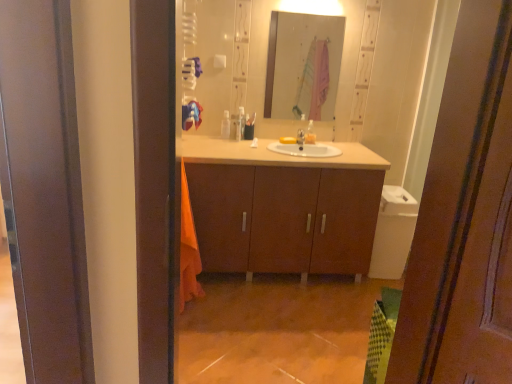
In order to face translucent plastic toothbrush holder at center, the second toiletry from the right, should I rotate leftwards or rightwards?

You should look left and rotate roughly 1.820 degrees.

How much space does orange cotton beach towel at left, acting as the second beach towel starting from the top, occupy horizontally?

6.02 inches.

What do you see at coordinates (310, 133) in the screenshot?
I see `translucent plastic bag at center, arranged as the 3th toiletry when viewed from the left` at bounding box center [310, 133].

This screenshot has width=512, height=384. What are the coordinates of `white plastic container at center, which is counted as the 1th toiletry, starting from the left` in the screenshot? It's located at (225, 125).

Can you see white plastic container at center, which is counted as the 1th toiletry, starting from the left, touching blue fabric beach towel at center, the 2th beach towel positioned from the bottom?

white plastic container at center, which is counted as the 1th toiletry, starting from the left, and blue fabric beach towel at center, the 2th beach towel positioned from the bottom, are not in contact.

From the image's perspective, is white plastic container at center, the 3th toiletry positioned from the right, positioned above or below blue fabric beach towel at center, arranged as the first beach towel when viewed from the top?

white plastic container at center, the 3th toiletry positioned from the right, is above blue fabric beach towel at center, arranged as the first beach towel when viewed from the top.

Is point (228, 119) farther from viewer compared to point (195, 121)?

Yes, point (228, 119) is behind point (195, 121).

Which is in front, point (224, 111) or point (300, 133)?

Point (300, 133)

Which is more to the left, white plastic container at center, which is counted as the 1th toiletry, starting from the left, or silver metallic tap at center?

white plastic container at center, which is counted as the 1th toiletry, starting from the left.

How many degrees apart are the facing directions of white plastic container at center, which is counted as the 1th toiletry, starting from the left, and silver metallic tap at center?

The angle between the facing direction of white plastic container at center, which is counted as the 1th toiletry, starting from the left, and the facing direction of silver metallic tap at center is 0.000344 degrees.

From a real-world perspective, is white plastic container at center, the 3th toiletry positioned from the right, located beneath silver metallic tap at center?

No, from a real-world perspective, white plastic container at center, the 3th toiletry positioned from the right, is not beneath silver metallic tap at center.

Where is `tap behind the clear glass mirror at upper center`? tap behind the clear glass mirror at upper center is located at coordinates (300, 137).

Is clear glass mirror at upper center positioned with its back to silver metallic tap at center?

clear glass mirror at upper center does not have its back to silver metallic tap at center.

Is clear glass mirror at upper center to the left of silver metallic tap at center from the viewer's perspective?

No, clear glass mirror at upper center is not to the left of silver metallic tap at center.

Is clear glass mirror at upper center not close to silver metallic tap at center?

That's right, there is a large distance between clear glass mirror at upper center and silver metallic tap at center.

Based on the photo, who is taller, orange cotton beach towel at left, acting as the 1th beach towel starting from the bottom, or clear glass mirror at upper center?

Standing taller between the two is orange cotton beach towel at left, acting as the 1th beach towel starting from the bottom.

Is orange cotton beach towel at left, acting as the second beach towel starting from the top, turned away from clear glass mirror at upper center?

orange cotton beach towel at left, acting as the second beach towel starting from the top, does not have its back to clear glass mirror at upper center.

Is orange cotton beach towel at left, acting as the second beach towel starting from the top, not inside clear glass mirror at upper center?

Indeed, orange cotton beach towel at left, acting as the second beach towel starting from the top, is completely outside clear glass mirror at upper center.

There is a clear glass mirror at upper center. Where is `the 2nd beach towel below it (from the image's perspective)`? The width and height of the screenshot is (512, 384). the 2nd beach towel below it (from the image's perspective) is located at coordinates (188, 249).

Could you tell me if orange cotton beach towel at left, acting as the second beach towel starting from the top, is facing silver metallic tap at center?

No.

Is silver metallic tap at center surrounded by orange cotton beach towel at left, acting as the 1th beach towel starting from the bottom?

Actually, silver metallic tap at center is outside orange cotton beach towel at left, acting as the 1th beach towel starting from the bottom.

From a real-world perspective, who is located higher, orange cotton beach towel at left, acting as the second beach towel starting from the top, or silver metallic tap at center?

silver metallic tap at center is physically above.

From a real-world perspective, is white plastic container at center, which is counted as the 1th toiletry, starting from the left, positioned above or below translucent plastic bag at center, arranged as the 3th toiletry when viewed from the left?

In terms of real-world spatial position, white plastic container at center, which is counted as the 1th toiletry, starting from the left, is below translucent plastic bag at center, arranged as the 3th toiletry when viewed from the left.

Is point (229, 126) farther from viewer compared to point (315, 139)?

That is True.

How distant is white plastic container at center, the 3th toiletry positioned from the right, from translucent plastic bag at center, the first toiletry from the right?

The distance of white plastic container at center, the 3th toiletry positioned from the right, from translucent plastic bag at center, the first toiletry from the right, is 22.09 inches.

Which object is closer to the camera taking this photo, white plastic container at center, which is counted as the 1th toiletry, starting from the left, or translucent plastic bag at center, arranged as the 3th toiletry when viewed from the left?

translucent plastic bag at center, arranged as the 3th toiletry when viewed from the left, is closer to the camera.

Between blue fabric beach towel at center, the 2th beach towel positioned from the bottom, and matte wood cabinet at center, which one has larger width?

Wider between the two is matte wood cabinet at center.

Is blue fabric beach towel at center, arranged as the first beach towel when viewed from the top, bigger than matte wood cabinet at center?

Actually, blue fabric beach towel at center, arranged as the first beach towel when viewed from the top, might be smaller than matte wood cabinet at center.

From a real-world perspective, is blue fabric beach towel at center, the 2th beach towel positioned from the bottom, located beneath matte wood cabinet at center?

Incorrect, from a real-world perspective, blue fabric beach towel at center, the 2th beach towel positioned from the bottom, is higher than matte wood cabinet at center.

Is the surface of blue fabric beach towel at center, arranged as the first beach towel when viewed from the top, in direct contact with matte wood cabinet at center?

blue fabric beach towel at center, arranged as the first beach towel when viewed from the top, and matte wood cabinet at center are not in contact.

Locate an element on the screen. This screenshot has height=384, width=512. beach towel above the white plastic container at center, which is counted as the 1th toiletry, starting from the left (from a real-world perspective) is located at coordinates (191, 115).

I want to click on tap that is on the right side of white plastic container at center, the 3th toiletry positioned from the right, so click(300, 137).

Looking at the image, which one is located closer to blue fabric beach towel at center, the 2th beach towel positioned from the bottom, orange cotton beach towel at left, acting as the 1th beach towel starting from the bottom, or translucent plastic toothbrush holder at center, positioned as the second toiletry in left-to-right order?

Among the two, translucent plastic toothbrush holder at center, positioned as the second toiletry in left-to-right order, is located nearer to blue fabric beach towel at center, the 2th beach towel positioned from the bottom.

Which object lies nearer to the anchor point matte wood cabinet at center, blue fabric beach towel at center, the 2th beach towel positioned from the bottom, or translucent plastic toothbrush holder at center, positioned as the second toiletry in left-to-right order?

translucent plastic toothbrush holder at center, positioned as the second toiletry in left-to-right order.

Estimate the real-world distances between objects in this image. Which object is further from blue fabric beach towel at center, the 2th beach towel positioned from the bottom, translucent plastic toothbrush holder at center, positioned as the second toiletry in left-to-right order, or white plastic container at center, the 3th toiletry positioned from the right?

translucent plastic toothbrush holder at center, positioned as the second toiletry in left-to-right order, is positioned further to the anchor blue fabric beach towel at center, the 2th beach towel positioned from the bottom.

Estimate the real-world distances between objects in this image. Which object is closer to white plastic container at center, which is counted as the 1th toiletry, starting from the left, translucent plastic toothbrush holder at center, positioned as the second toiletry in left-to-right order, or silver metallic tap at center?

translucent plastic toothbrush holder at center, positioned as the second toiletry in left-to-right order, is positioned closer to the anchor white plastic container at center, which is counted as the 1th toiletry, starting from the left.

Based on their spatial positions, is blue fabric beach towel at center, the 2th beach towel positioned from the bottom, or clear glass mirror at upper center closer to orange cotton beach towel at left, acting as the second beach towel starting from the top?

blue fabric beach towel at center, the 2th beach towel positioned from the bottom, is positioned closer to the anchor orange cotton beach towel at left, acting as the second beach towel starting from the top.

Which object lies further to the anchor point translucent plastic toothbrush holder at center, the second toiletry from the right, clear glass mirror at upper center or translucent plastic bag at center, arranged as the 3th toiletry when viewed from the left?

Based on the image, clear glass mirror at upper center appears to be further to translucent plastic toothbrush holder at center, the second toiletry from the right.

Considering their positions, is clear glass mirror at upper center positioned further to matte wood cabinet at center than blue fabric beach towel at center, arranged as the first beach towel when viewed from the top?

clear glass mirror at upper center.

Based on their spatial positions, is silver metallic tap at center or orange cotton beach towel at left, acting as the second beach towel starting from the top, closer to white plastic container at center, which is counted as the 1th toiletry, starting from the left?

silver metallic tap at center.

Where is `tap between white plastic container at center, which is counted as the 1th toiletry, starting from the left, and clear glass mirror at upper center, in the horizontal direction`? The width and height of the screenshot is (512, 384). tap between white plastic container at center, which is counted as the 1th toiletry, starting from the left, and clear glass mirror at upper center, in the horizontal direction is located at coordinates (300, 137).

Identify the location of tap between translucent plastic bag at center, the first toiletry from the right, and matte wood cabinet at center, in the vertical direction. (300, 137).

Locate an element on the screen. The height and width of the screenshot is (384, 512). bathroom cabinet between orange cotton beach towel at left, acting as the 1th beach towel starting from the bottom, and translucent plastic toothbrush holder at center, positioned as the second toiletry in left-to-right order, along the z-axis is located at coordinates (283, 207).

I want to click on tap located between blue fabric beach towel at center, the 2th beach towel positioned from the bottom, and clear glass mirror at upper center in the left-right direction, so click(300, 137).